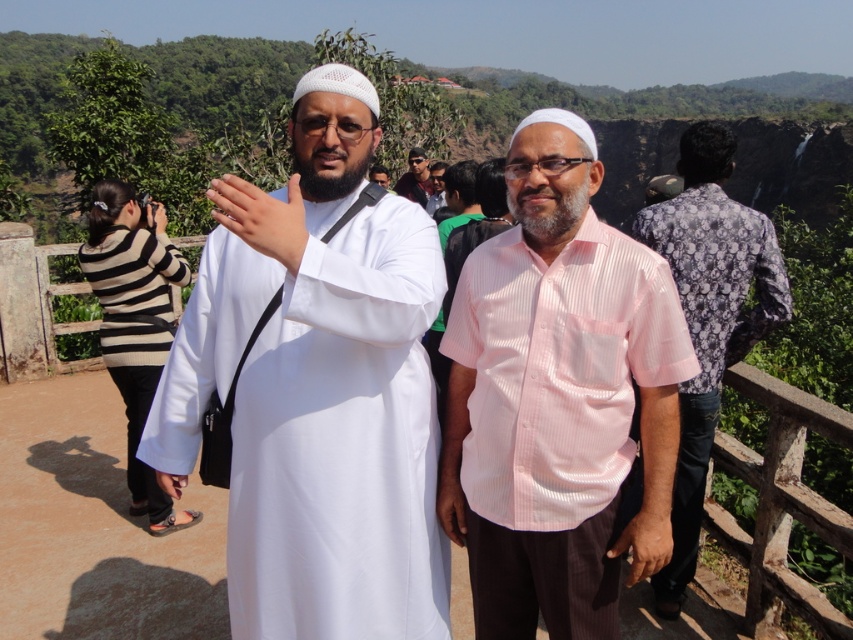
Can you confirm if floral-patterned fabric shirt at right is thinner than white matte hand at center?

Incorrect, floral-patterned fabric shirt at right's width is not less than white matte hand at center's.

Is floral-patterned fabric shirt at right taller than white matte hand at center?

Yes, floral-patterned fabric shirt at right is taller than white matte hand at center.

Is point (695, 269) closer to viewer compared to point (300, 237)?

No, it is not.

The height and width of the screenshot is (640, 853). Find the location of `floral-patterned fabric shirt at right`. floral-patterned fabric shirt at right is located at coordinates (711, 332).

Is striped sweater at left shorter than brown leather hand at center?

In fact, striped sweater at left may be taller than brown leather hand at center.

Does striped sweater at left appear under brown leather hand at center?

Incorrect, striped sweater at left is not positioned below brown leather hand at center.

Is point (102, 280) positioned after point (440, 477)?

Yes, it is.

You are a GUI agent. You are given a task and a screenshot of the screen. Output one action in this format:
    pyautogui.click(x=<x>, y=<y>)
    Task: Click on the striped sweater at left
    This screenshot has height=640, width=853.
    Given the screenshot: What is the action you would take?
    pyautogui.click(x=134, y=324)

Does white matte robe at center have a smaller size compared to light pink shirt at center?

No.

The width and height of the screenshot is (853, 640). I want to click on white matte robe at center, so click(x=318, y=388).